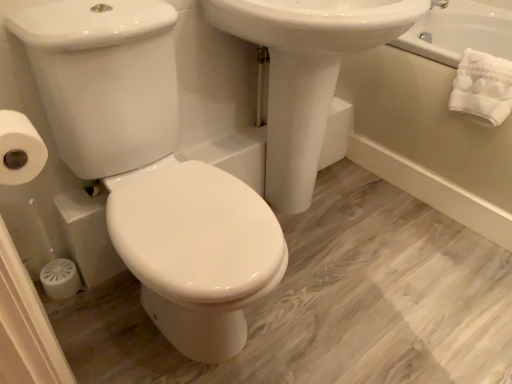
Question: From a real-world perspective, is white soft towel at upper right physically above white glossy porcelain at center?

Choices:
 (A) no
 (B) yes

Answer: (B)

Question: From the image's perspective, does white soft towel at upper right appear higher than white glossy porcelain at center?

Choices:
 (A) no
 (B) yes

Answer: (B)

Question: Would you say white glossy porcelain at center is part of white soft towel at upper right's contents?

Choices:
 (A) yes
 (B) no

Answer: (B)

Question: Considering the relative sizes of white soft towel at upper right and white glossy porcelain at center in the image provided, is white soft towel at upper right wider than white glossy porcelain at center?

Choices:
 (A) yes
 (B) no

Answer: (B)

Question: Is white soft towel at upper right looking in the opposite direction of white glossy porcelain at center?

Choices:
 (A) yes
 (B) no

Answer: (B)

Question: Is white matte toilet paper at left to the left or to the right of white glossy sink at center in the image?

Choices:
 (A) right
 (B) left

Answer: (B)

Question: Based on their sizes in the image, would you say white matte toilet paper at left is bigger or smaller than white glossy sink at center?

Choices:
 (A) small
 (B) big

Answer: (A)

Question: From a real-world perspective, is white matte toilet paper at left above or below white glossy sink at center?

Choices:
 (A) above
 (B) below

Answer: (A)

Question: Is white matte toilet paper at left spatially inside white glossy sink at center, or outside of it?

Choices:
 (A) inside
 (B) outside

Answer: (B)

Question: Considering the positions of white glossy porcelain at center and white glossy bathtub at upper right in the image, is white glossy porcelain at center wider or thinner than white glossy bathtub at upper right?

Choices:
 (A) wide
 (B) thin

Answer: (B)

Question: Is white glossy porcelain at center situated inside white glossy bathtub at upper right or outside?

Choices:
 (A) outside
 (B) inside

Answer: (A)

Question: From the image's perspective, is white glossy porcelain at center positioned above or below white glossy bathtub at upper right?

Choices:
 (A) below
 (B) above

Answer: (A)

Question: Does point (243, 342) appear closer or farther from the camera than point (393, 77)?

Choices:
 (A) closer
 (B) farther

Answer: (A)

Question: From their relative heights in the image, would you say white soft towel at upper right is taller or shorter than white matte toilet paper at left?

Choices:
 (A) tall
 (B) short

Answer: (A)

Question: Would you say white soft towel at upper right is to the left or to the right of white matte toilet paper at left in the picture?

Choices:
 (A) left
 (B) right

Answer: (B)